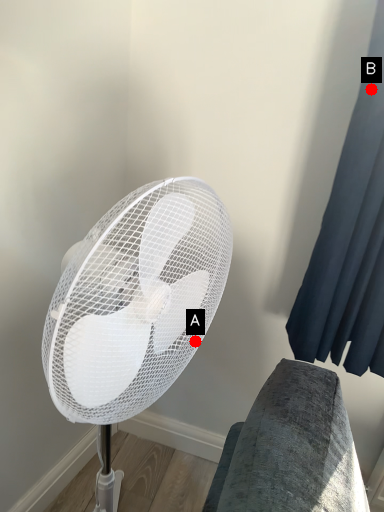
Question: Two points are circled on the image, labeled by A and B beside each circle. Which point is farther from the camera taking this photo?

Choices:
 (A) A is further
 (B) B is further

Answer: (B)